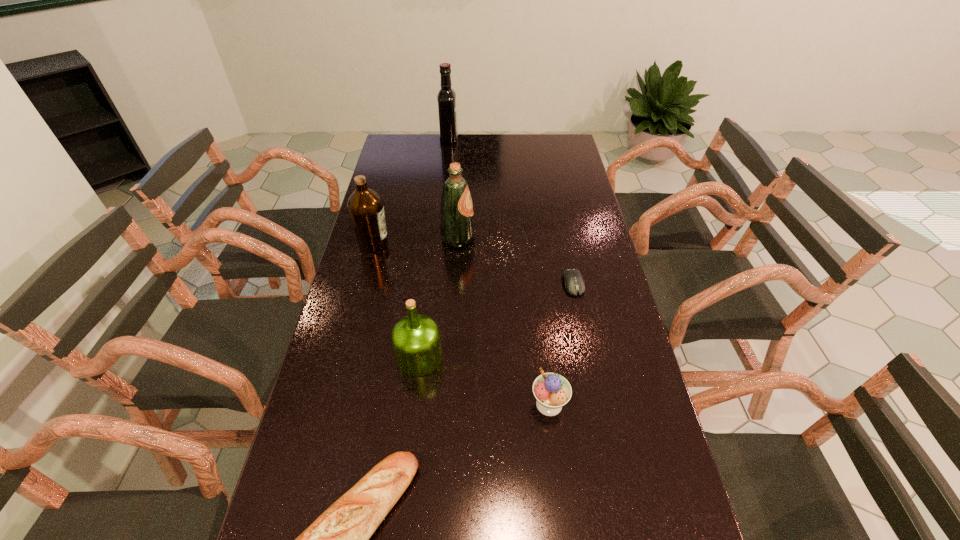
This screenshot has height=540, width=960. Find the location of `blank area located on the front of the fourth tallest object`. blank area located on the front of the fourth tallest object is located at coordinates 411,428.

What are the coordinates of `vacant space situated on the right of the sixth farthest object` in the screenshot? It's located at (616, 404).

Image resolution: width=960 pixels, height=540 pixels. Find the location of `free region located 0.340m on the back of the rightmost object`. free region located 0.340m on the back of the rightmost object is located at coordinates (558, 208).

Where is `object that is positioned at the far edge`? object that is positioned at the far edge is located at coordinates (446, 97).

The image size is (960, 540). In order to click on object present at the left edge in this screenshot , I will do `click(366, 209)`.

Identify the location of object positioned at the right edge. (574, 283).

Find the location of a particular element. The height and width of the screenshot is (540, 960). vacant region at the left edge of the desktop is located at coordinates (327, 420).

You are a GUI agent. You are given a task and a screenshot of the screen. Output one action in this format:
    pyautogui.click(x=<x>, y=<y>)
    Task: Click on the free space at the right edge of the desktop
    The width and height of the screenshot is (960, 540).
    Given the screenshot: What is the action you would take?
    pyautogui.click(x=548, y=183)

Identify the location of vacant region at the far left corner of the desktop. This screenshot has width=960, height=540. pos(424,138).

In the image, there is a desktop. Where is `free space at the far right corner`? The height and width of the screenshot is (540, 960). free space at the far right corner is located at coordinates (563, 154).